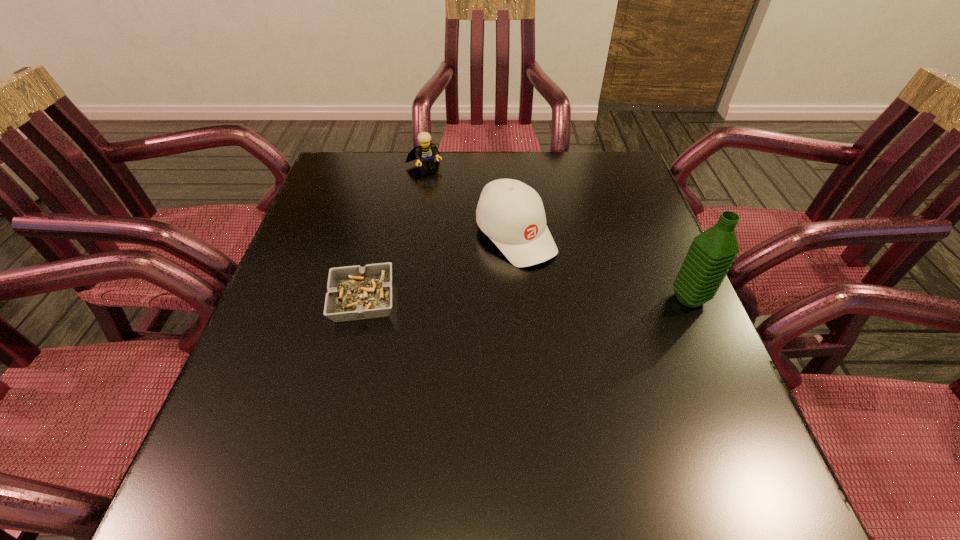
Locate an element on the screen. blank space located 0.200m on the front-facing side of the baseball cap is located at coordinates (593, 325).

Identify the location of vacant space positioned 0.340m on the front-facing side of the farthest object. This screenshot has height=540, width=960. (486, 242).

The image size is (960, 540). What are the coordinates of `vacant area situated on the front-facing side of the farthest object` in the screenshot? It's located at (444, 190).

Find the location of a particular element. The image size is (960, 540). vacant space located 0.250m on the front-facing side of the farthest object is located at coordinates (469, 222).

You are a GUI agent. You are given a task and a screenshot of the screen. Output one action in this format:
    pyautogui.click(x=<x>, y=<y>)
    Task: Click on the object that is at the far edge
    Image resolution: width=960 pixels, height=540 pixels.
    Given the screenshot: What is the action you would take?
    pyautogui.click(x=424, y=154)

Find the location of `object situated at the left edge`. object situated at the left edge is located at coordinates (354, 293).

Where is `object present at the right edge`? object present at the right edge is located at coordinates (711, 254).

In the image, there is a desktop. Where is `free space at the far edge`? free space at the far edge is located at coordinates (441, 167).

In the image, there is a desktop. Where is `free region at the near edge`? free region at the near edge is located at coordinates (381, 443).

You are a GUI agent. You are given a task and a screenshot of the screen. Output one action in this format:
    pyautogui.click(x=<x>, y=<y>)
    Task: Click on the free space at the left edge of the desktop
    This screenshot has width=960, height=540.
    Given the screenshot: What is the action you would take?
    coord(354,199)